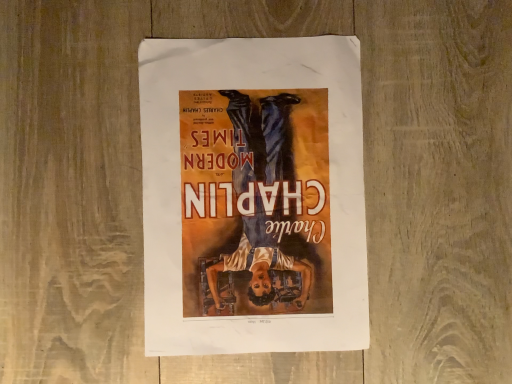
In order to click on matte paper poster at center in this screenshot , I will do `click(253, 195)`.

In order to face matte paper poster at center, should I rotate leftwards or rightwards?

To face it directly, rotate left by 0.376 degrees.

The image size is (512, 384). What do you see at coordinates (253, 195) in the screenshot?
I see `matte paper poster at center` at bounding box center [253, 195].

This screenshot has height=384, width=512. I want to click on matte paper poster at center, so click(253, 195).